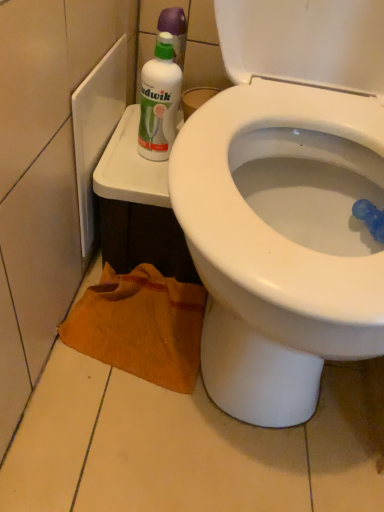
Locate an element on the screen. This screenshot has height=512, width=384. free spot in front of white plastic bottle at upper left is located at coordinates (134, 179).